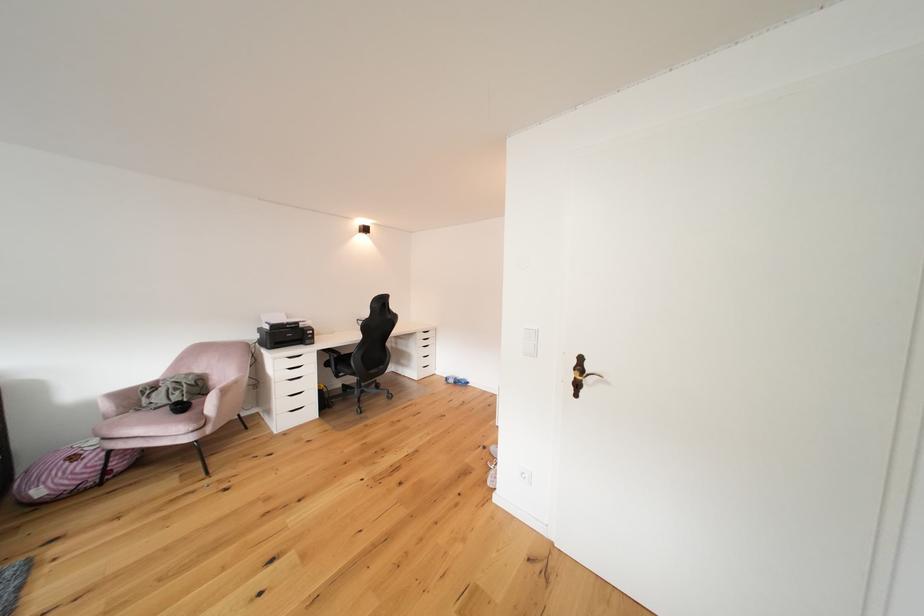
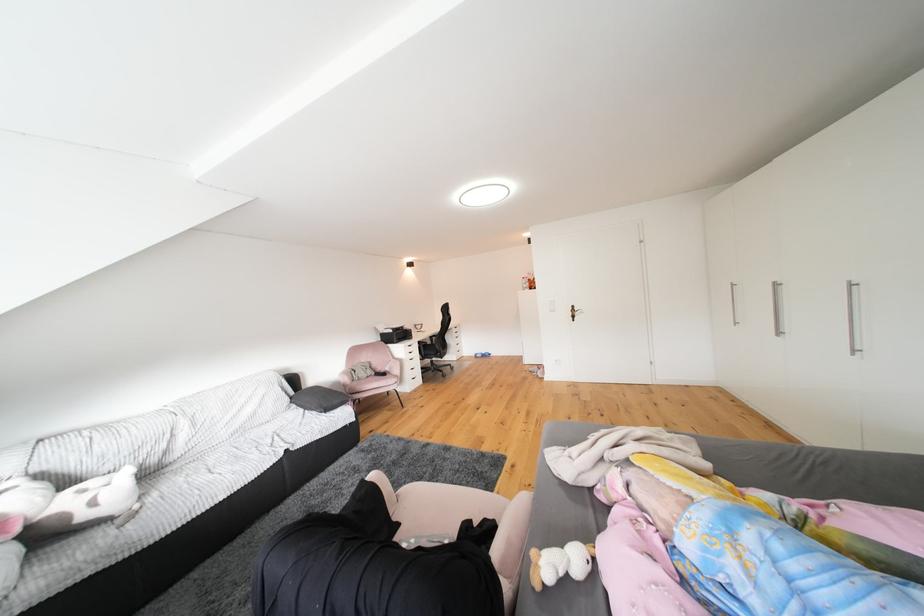
What movement of the cameraman would produce the second image?

The cameraman walked toward left, backward.